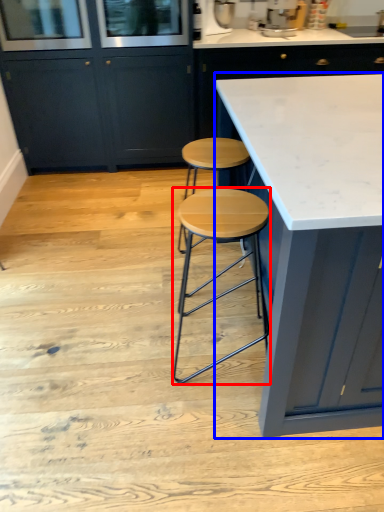
Question: Which point is further to the camera, stool (highlighted by a red box) or countertop (highlighted by a blue box)?

Choices:
 (A) stool
 (B) countertop

Answer: (A)